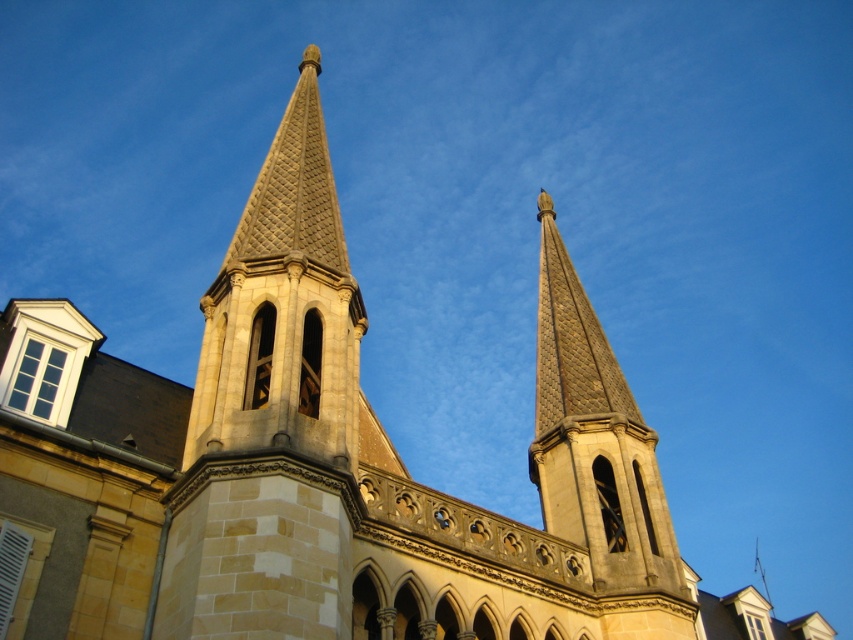
Question: Which object is closer to the camera taking this photo?

Choices:
 (A) stone spire at center
 (B) beige stone spire at upper center

Answer: (B)

Question: Which of the following is the farthest from the observer?

Choices:
 (A) stone spire at center
 (B) beige stone spire at upper center

Answer: (A)

Question: Does beige stone spire at upper center have a greater width compared to stone spire at center?

Choices:
 (A) no
 (B) yes

Answer: (B)

Question: Is the position of beige stone spire at upper center more distant than that of stone spire at center?

Choices:
 (A) yes
 (B) no

Answer: (B)

Question: Can you confirm if beige stone spire at upper center is positioned below stone spire at center?

Choices:
 (A) no
 (B) yes

Answer: (A)